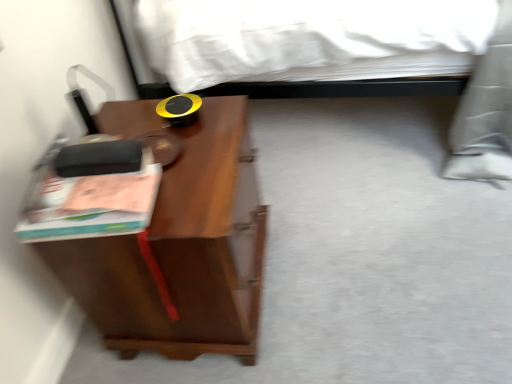
Identify the location of vacant point above brown wood nightstand at left (from a real-world perspective). (182, 145).